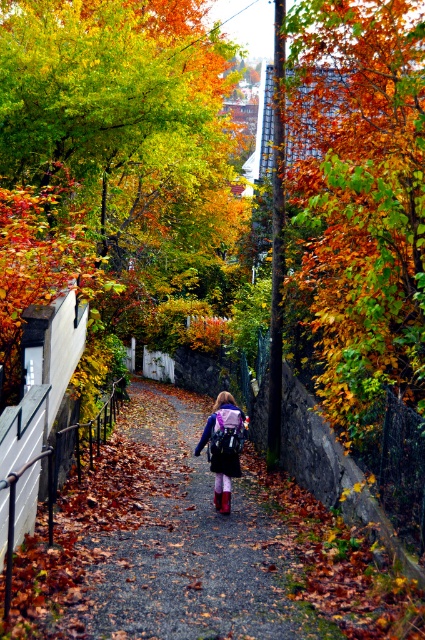
Which is below, autumn leaves at upper right or shiny orange leaves at upper center?

autumn leaves at upper right

Describe the element at coordinates (357, 196) in the screenshot. I see `autumn leaves at upper right` at that location.

Identify the location of autumn leaves at upper right. (357, 196).

Looking at this image, can you confirm if autumn leaves at upper right is wider than matte purple backpack at center?

Indeed, autumn leaves at upper right has a greater width compared to matte purple backpack at center.

Can you confirm if autumn leaves at upper right is positioned to the right of matte purple backpack at center?

Yes, autumn leaves at upper right is to the right of matte purple backpack at center.

Does point (308, 212) lie in front of point (226, 465)?

Yes, it is.

This screenshot has height=640, width=425. Find the location of `autumn leaves at upper right`. autumn leaves at upper right is located at coordinates (357, 196).

In order to click on shiny orange leaves at upper center in this screenshot , I will do `click(124, 116)`.

Identify the location of shiny orange leaves at upper center. (124, 116).